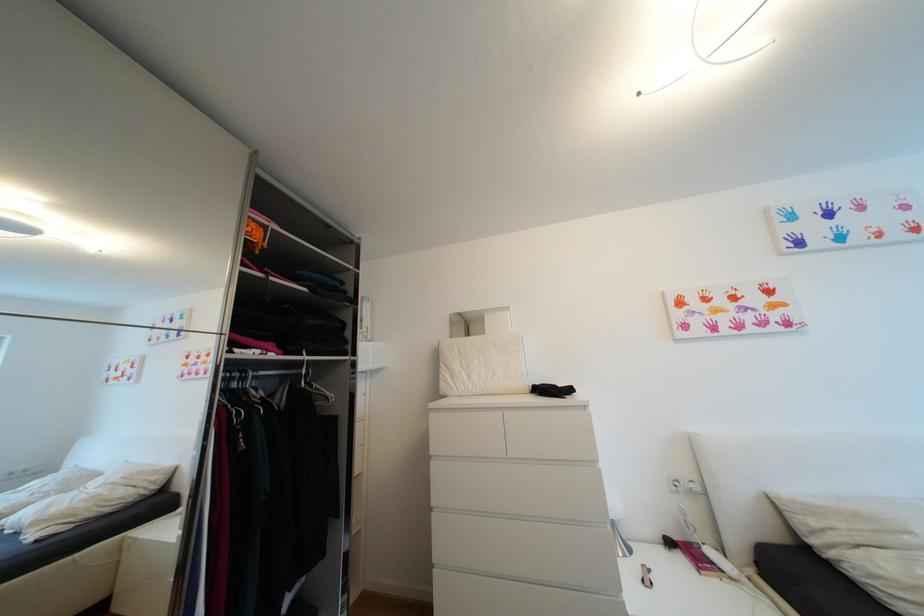
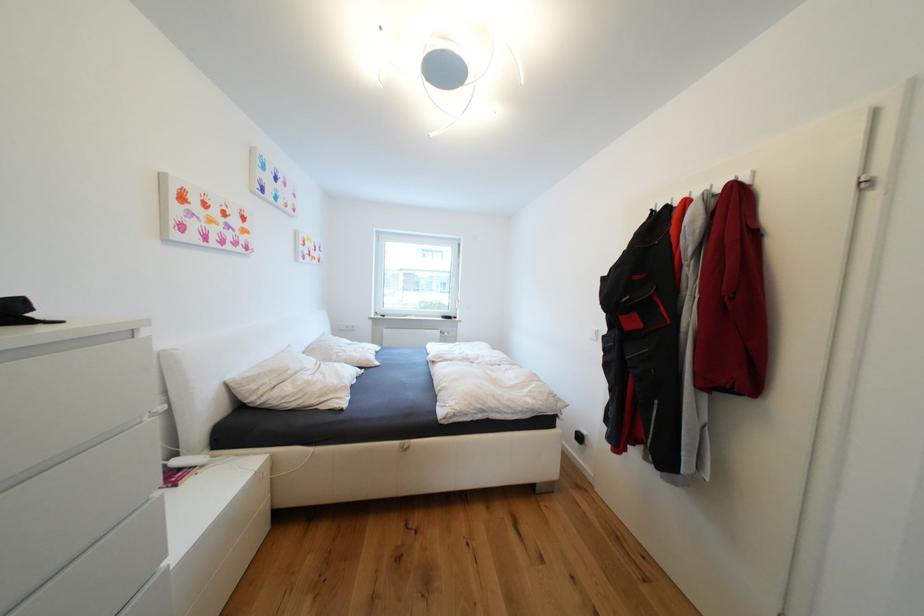
Question: The camera is either moving clockwise (left) or counter-clockwise (right) around the object. The first image is from the beginning of the video and the second image is from the end. Is the camera moving left or right when shooting the video?

Choices:
 (A) Left
 (B) Right

Answer: (A)